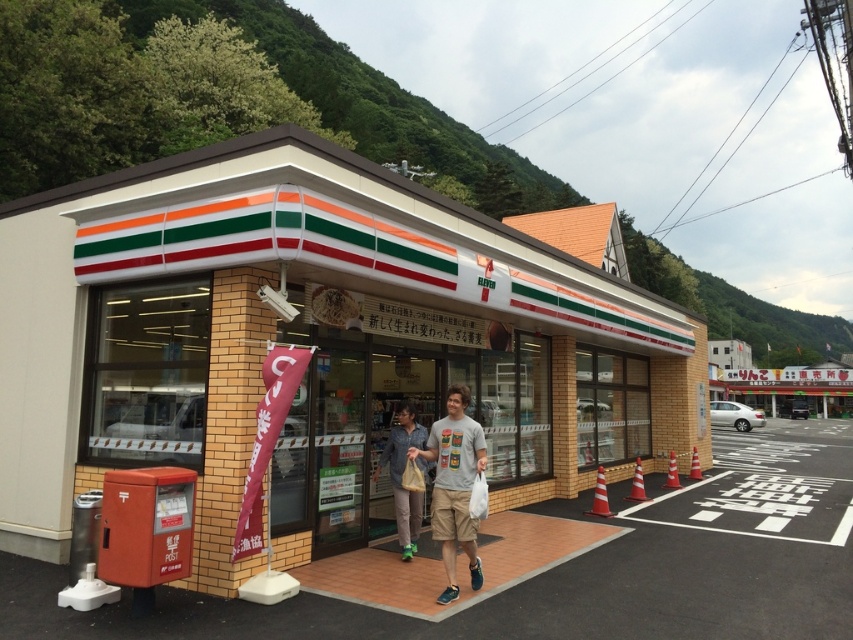
What do you see at coordinates (309, 344) in the screenshot? The image size is (853, 640). I see `brick facade convenience store at center` at bounding box center [309, 344].

Does brick facade convenience store at center have a greater width compared to gray cotton t-shirt at center?

Correct, the width of brick facade convenience store at center exceeds that of gray cotton t-shirt at center.

Is point (212, 499) less distant than point (480, 451)?

No, (212, 499) is further to viewer.

This screenshot has height=640, width=853. Find the location of `brick facade convenience store at center`. brick facade convenience store at center is located at coordinates (309, 344).

Is point (117, 332) positioned before point (389, 436)?

That is True.

Identify the location of brick facade convenience store at center. The height and width of the screenshot is (640, 853). (309, 344).

Between point (428, 458) and point (399, 516), which one is positioned in front?

Point (428, 458)

Between gray cotton t-shirt at center and denim shirt at center, which one has less height?

Standing shorter between the two is denim shirt at center.

Where is `gray cotton t-shirt at center`? gray cotton t-shirt at center is located at coordinates (454, 484).